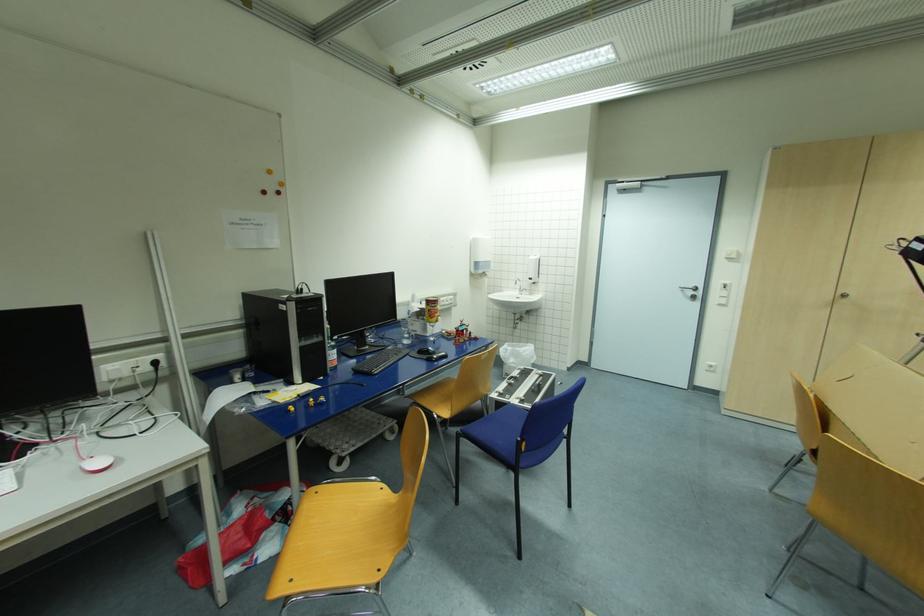
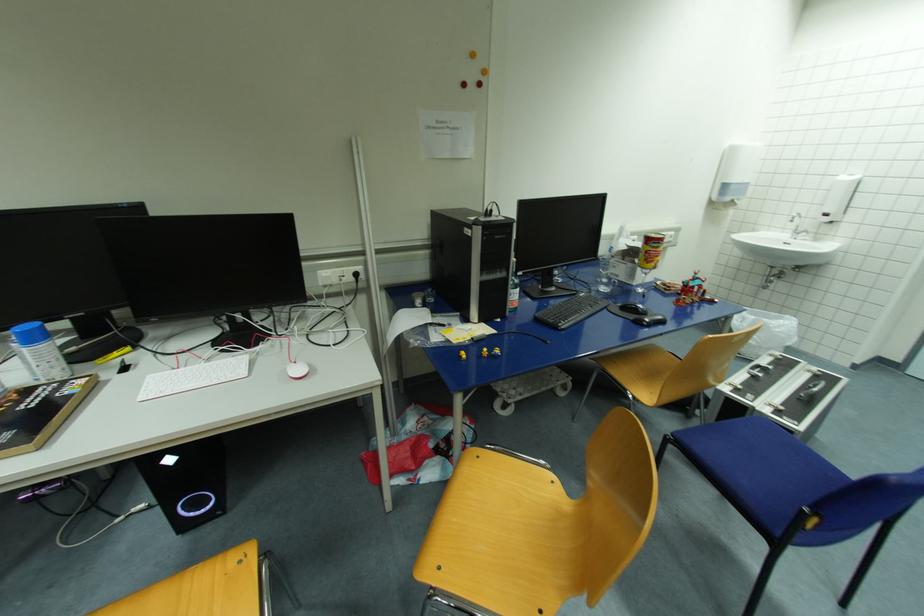
Question: The camera is either moving clockwise (left) or counter-clockwise (right) around the object. The first image is from the beginning of the video and the second image is from the end. Is the camera moving left or right when shooting the video?

Choices:
 (A) Left
 (B) Right

Answer: (B)